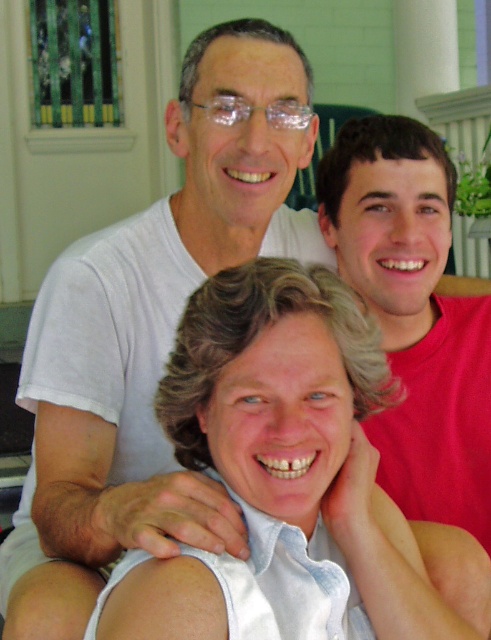
Describe the element at coordinates (151, 332) in the screenshot. I see `white matte t-shirt at upper center` at that location.

Is white matte t-shirt at upper center positioned behind gray silk shirt at center?

Yes, white matte t-shirt at upper center is behind gray silk shirt at center.

Locate an element on the screen. Image resolution: width=491 pixels, height=640 pixels. white matte t-shirt at upper center is located at coordinates (151, 332).

What are the coordinates of `white matte t-shirt at upper center` in the screenshot? It's located at (151, 332).

Is white matte t-shirt at upper center to the right of red matte shirt at upper right from the viewer's perspective?

In fact, white matte t-shirt at upper center is to the left of red matte shirt at upper right.

Which of these two, white matte t-shirt at upper center or red matte shirt at upper right, stands taller?

Standing taller between the two is white matte t-shirt at upper center.

The height and width of the screenshot is (640, 491). Find the location of `white matte t-shirt at upper center`. white matte t-shirt at upper center is located at coordinates (151, 332).

At what (x,y) coordinates should I click in order to perform the action: click on white matte t-shirt at upper center. Please return your answer as a coordinate pair (x, y). The image size is (491, 640). Looking at the image, I should click on (151, 332).

Can you confirm if gray silk shirt at center is shorter than red matte shirt at upper right?

Correct, gray silk shirt at center is not as tall as red matte shirt at upper right.

Who is positioned more to the right, gray silk shirt at center or red matte shirt at upper right?

From the viewer's perspective, red matte shirt at upper right appears more on the right side.

Identify the location of gray silk shirt at center. This screenshot has width=491, height=640. (x=278, y=474).